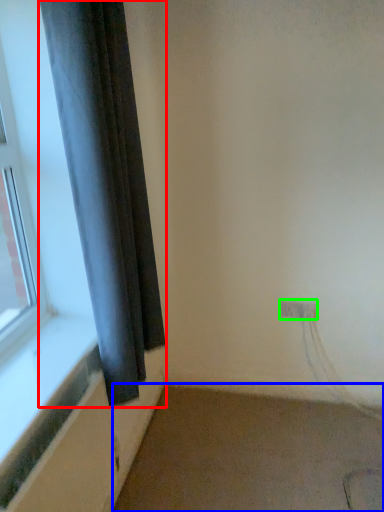
Question: Based on their relative distances, which object is nearer to curtain (highlighted by a red box)? Choose from plain (highlighted by a blue box) and electric outlet (highlighted by a green box).

Choices:
 (A) plain
 (B) electric outlet

Answer: (A)